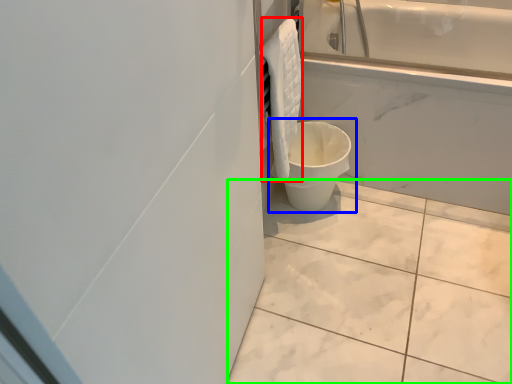
Question: Which object is positioned closest to material (highlighted by a red box)? Select from toilet (highlighted by a blue box) and ceramic tile (highlighted by a green box).

Choices:
 (A) toilet
 (B) ceramic tile

Answer: (A)